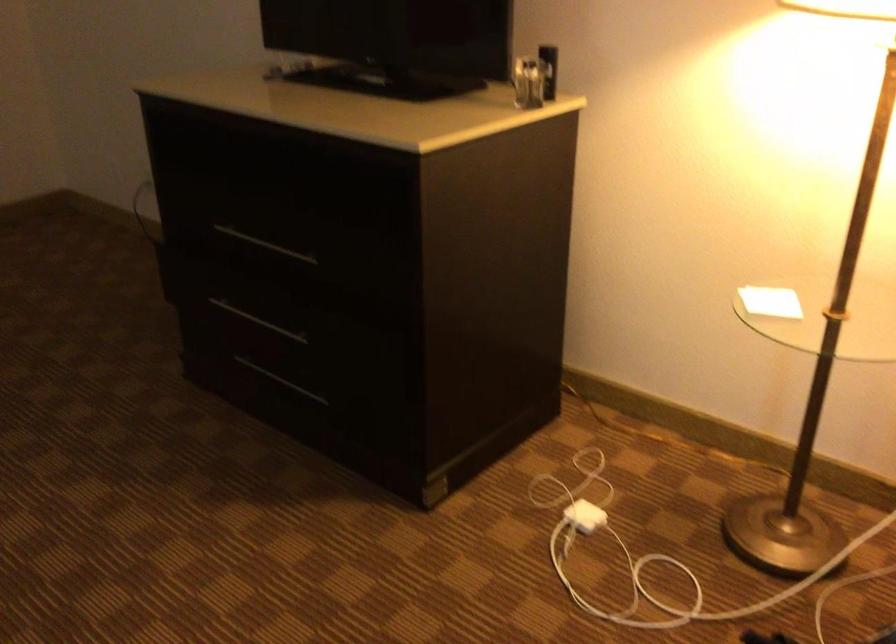
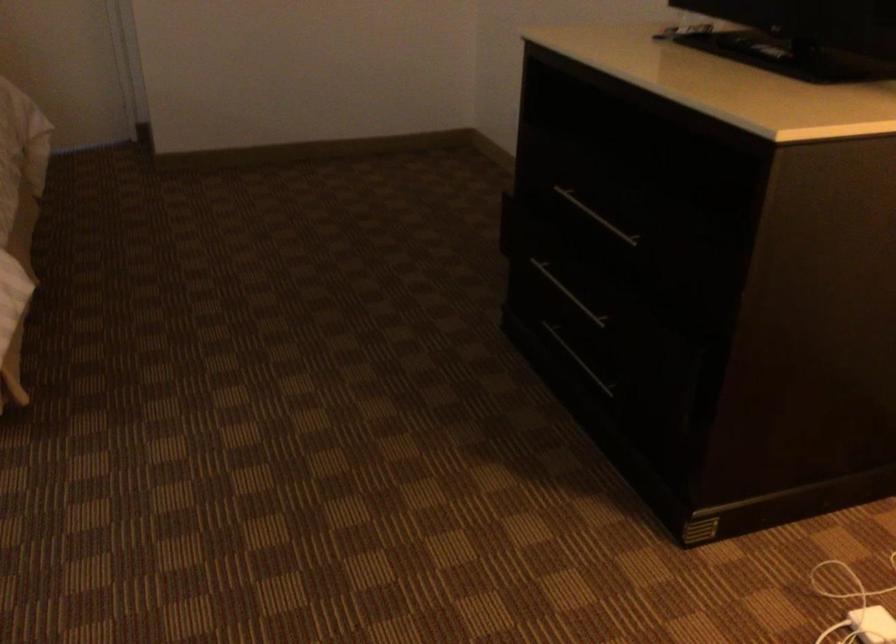
Locate, in the second image, the point that corresponds to the point at 256,322 in the first image.

(567, 292)